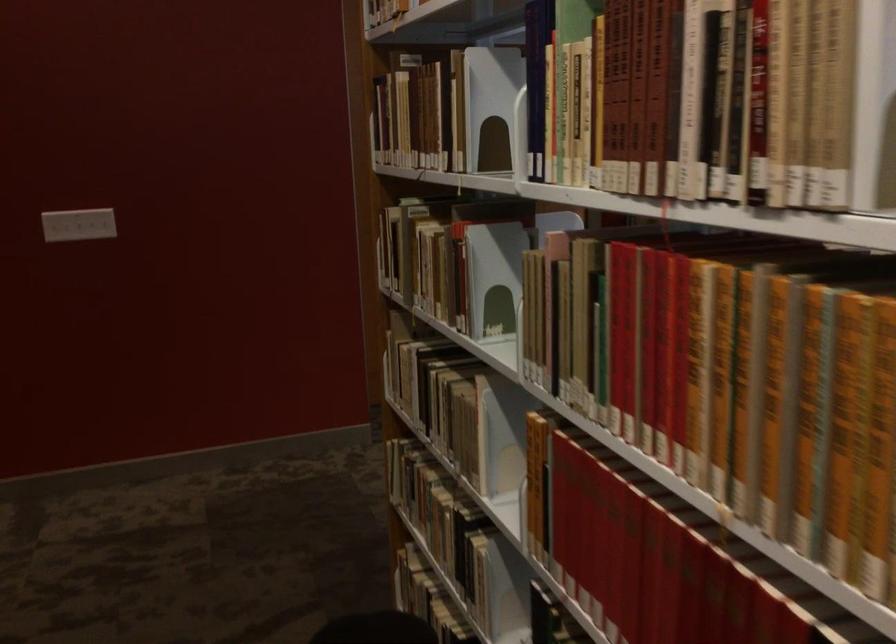
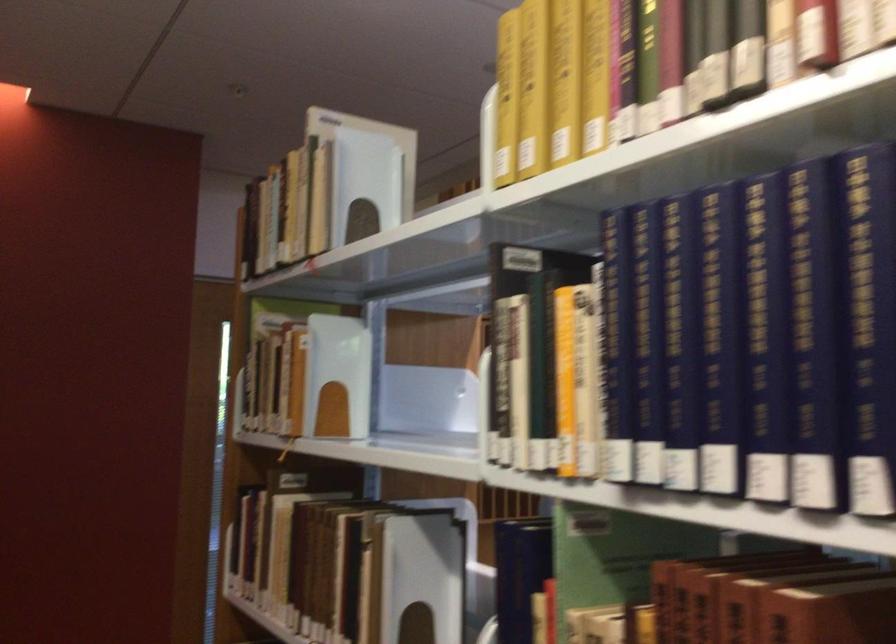
What movement of the cameraman would produce the second image?

The cameraman walked toward left, forward.